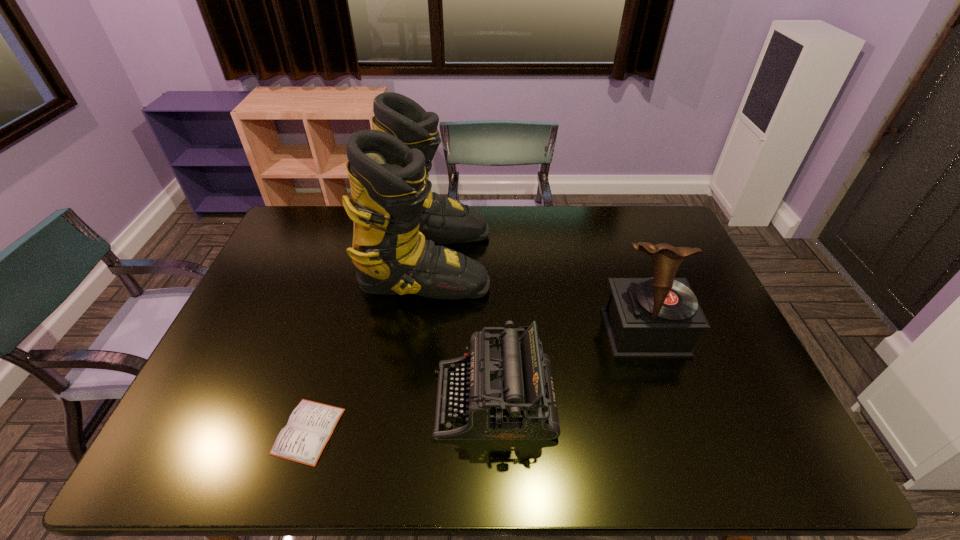
You are a GUI agent. You are given a task and a screenshot of the screen. Output one action in this format:
    pyautogui.click(x=<x>, y=<y>)
    Task: Click on the vacant area at the far right corner
    This screenshot has height=540, width=960.
    Given the screenshot: What is the action you would take?
    pyautogui.click(x=669, y=226)

Find the location of `vacant region between the typewriter and the ski boots`. vacant region between the typewriter and the ski boots is located at coordinates (461, 330).

Image resolution: width=960 pixels, height=540 pixels. I want to click on free spot between the typewriter and the diary, so click(401, 416).

The width and height of the screenshot is (960, 540). Identify the location of vacant space that's between the phonograph_record and the ski boots. (536, 297).

The width and height of the screenshot is (960, 540). I want to click on free area in between the diary and the typewriter, so click(x=401, y=416).

Locate an element on the screen. This screenshot has width=960, height=540. empty space that is in between the shortest object and the typewriter is located at coordinates (401, 416).

This screenshot has height=540, width=960. I want to click on free spot between the ski boots and the third tallest object, so click(x=461, y=330).

Identify the location of empty space that is in between the third tallest object and the second tallest object. (569, 367).

The image size is (960, 540). I want to click on free spot between the third tallest object and the phonograph_record, so click(569, 367).

Select which object appears as the closest to the diary. Please provide its 2D coordinates. Your answer should be formatted as a tuple, i.e. [(x, y)], where the tuple contains the x and y coordinates of a point satisfying the conditions above.

[(508, 393)]